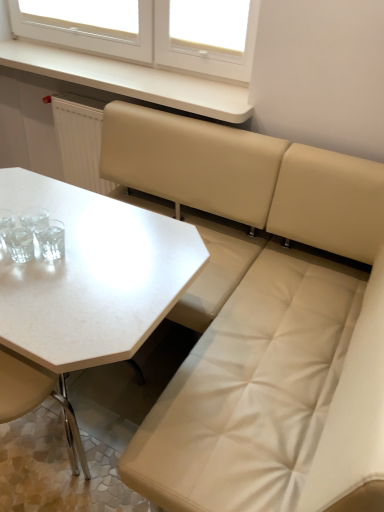
Question: Is white matte counter top at upper center not inside beige leather chair at lower left?

Choices:
 (A) yes
 (B) no

Answer: (A)

Question: Considering the relative positions of white matte counter top at upper center and beige leather chair at lower left in the image provided, is white matte counter top at upper center behind beige leather chair at lower left?

Choices:
 (A) yes
 (B) no

Answer: (A)

Question: Is white matte counter top at upper center thinner than beige leather chair at lower left?

Choices:
 (A) yes
 (B) no

Answer: (B)

Question: Is white matte counter top at upper center taller than beige leather chair at lower left?

Choices:
 (A) yes
 (B) no

Answer: (B)

Question: Is white matte counter top at upper center at the left side of beige leather chair at lower left?

Choices:
 (A) yes
 (B) no

Answer: (B)

Question: Would you say white matte counter top at upper center contains beige leather chair at lower left?

Choices:
 (A) yes
 (B) no

Answer: (B)

Question: Is white matte counter top at upper center taller than white matte table at center?

Choices:
 (A) yes
 (B) no

Answer: (B)

Question: From a real-world perspective, is white matte counter top at upper center on white matte table at center?

Choices:
 (A) no
 (B) yes

Answer: (B)

Question: Could you tell me if white matte counter top at upper center is facing white matte table at center?

Choices:
 (A) yes
 (B) no

Answer: (B)

Question: From the image's perspective, is white matte counter top at upper center over white matte table at center?

Choices:
 (A) no
 (B) yes

Answer: (B)

Question: Is white matte counter top at upper center looking in the opposite direction of white matte table at center?

Choices:
 (A) no
 (B) yes

Answer: (A)

Question: From a real-world perspective, does white matte counter top at upper center sit lower than white matte table at center?

Choices:
 (A) no
 (B) yes

Answer: (A)

Question: From a real-world perspective, is transparent plastic at upper center located beneath beige leather chair at lower left?

Choices:
 (A) yes
 (B) no

Answer: (B)